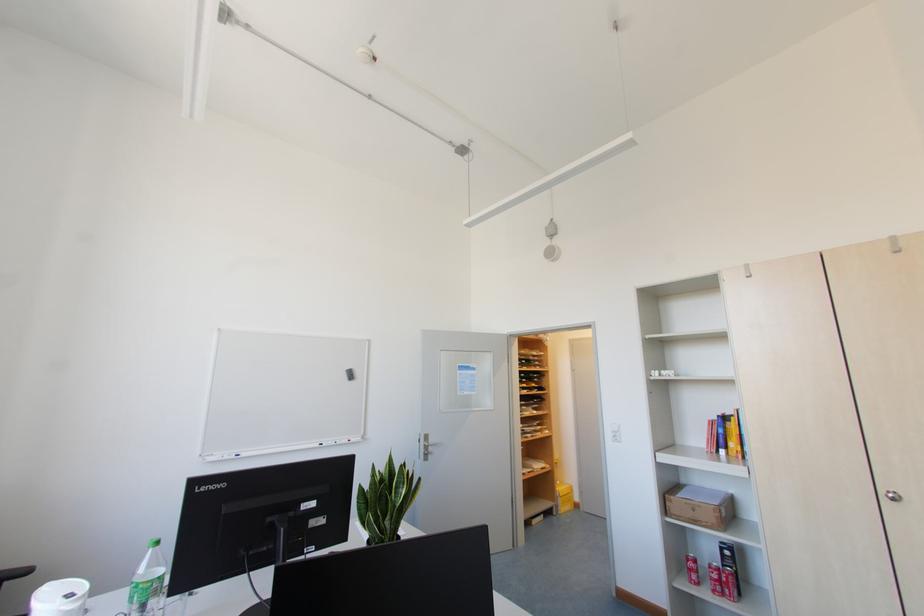
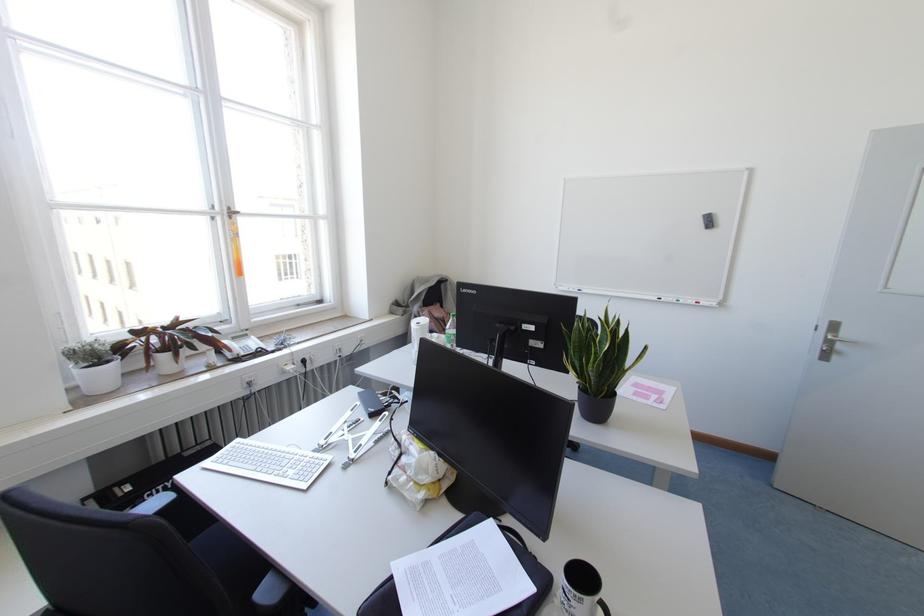
Find the pixel in the second image that matches point 334,442 in the first image.

(676, 300)